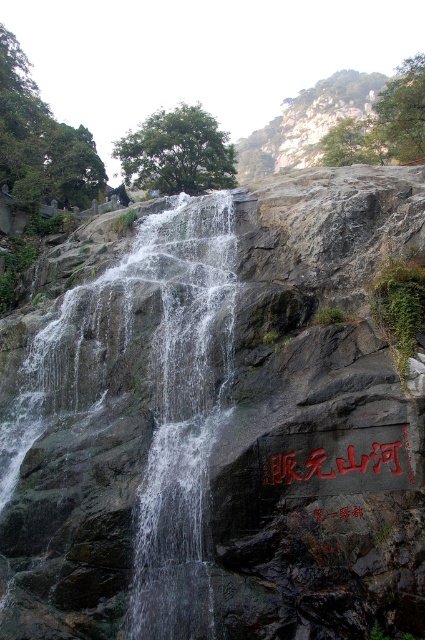
From the picture: You are a hiker who wants to read both the black stone writing at center and the black stone sign at center. Since you have a 1.5 meter long stick, can you reach both from your current position without moving closer? Explain your reasoning.

The black stone writing at center and black stone sign at center are 1.25 meters apart. Since your stick is 1.5 meters long, which is longer than the distance between them, you can reach both by extending the stick appropriately without needing to move closer.